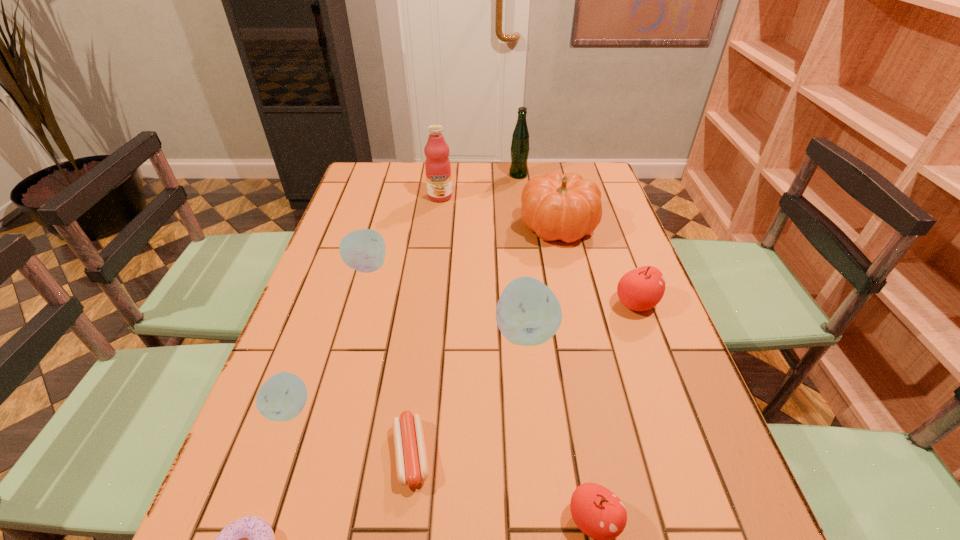
At what (x,y) coordinates should I click in order to perform the action: click on the bigger red apple. Please return your answer as a coordinate pair (x, y). The width and height of the screenshot is (960, 540). Looking at the image, I should click on (642, 288).

You are a GUI agent. You are given a task and a screenshot of the screen. Output one action in this format:
    pyautogui.click(x=<x>, y=<y>)
    Task: Click on the farther red apple
    This screenshot has width=960, height=540.
    Given the screenshot: What is the action you would take?
    pyautogui.click(x=642, y=288)

I want to click on the smallest white apple, so click(x=282, y=397).

Identify the location of the fourth farthest apple. (282, 397).

Find the location of a particular element. brown sausage is located at coordinates (412, 468).

You are a GUI agent. You are given a task and a screenshot of the screen. Output one action in this format:
    pyautogui.click(x=<x>, y=<y>)
    Task: Click on the vacant region located on the right of the beer bottle
    This screenshot has width=960, height=540.
    Given the screenshot: What is the action you would take?
    pyautogui.click(x=555, y=175)

Identify the location of vacant space located on the label of the ninth nearest object. (433, 255).

Locate an element on the screen. vacant space located 0.100m on the back of the third tallest object is located at coordinates (550, 189).

This screenshot has width=960, height=540. In order to click on vacant space located 0.250m on the right of the rightmost white apple in this screenshot , I will do `click(662, 332)`.

This screenshot has height=540, width=960. In order to click on vacant space situated 0.100m on the back of the seventh nearest object in this screenshot , I will do `click(377, 233)`.